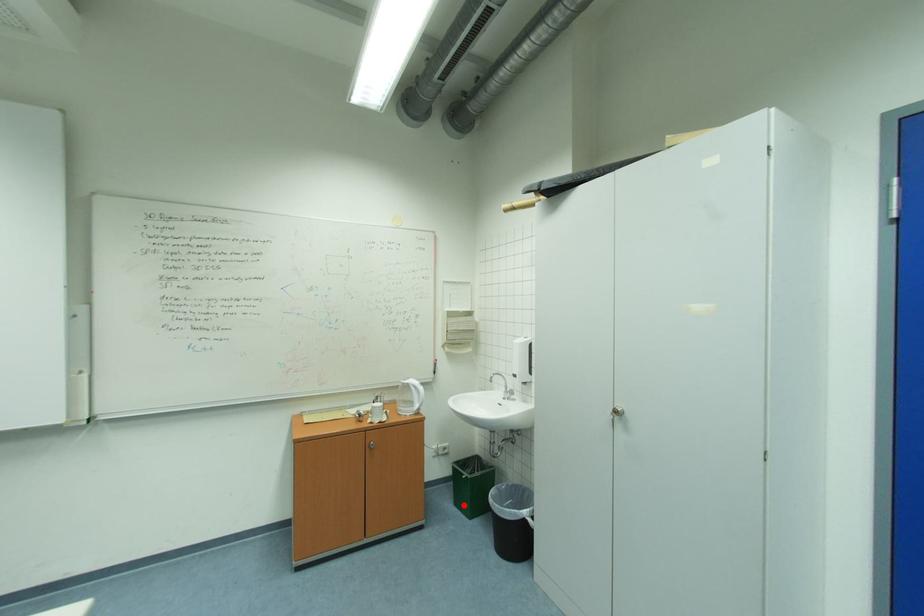
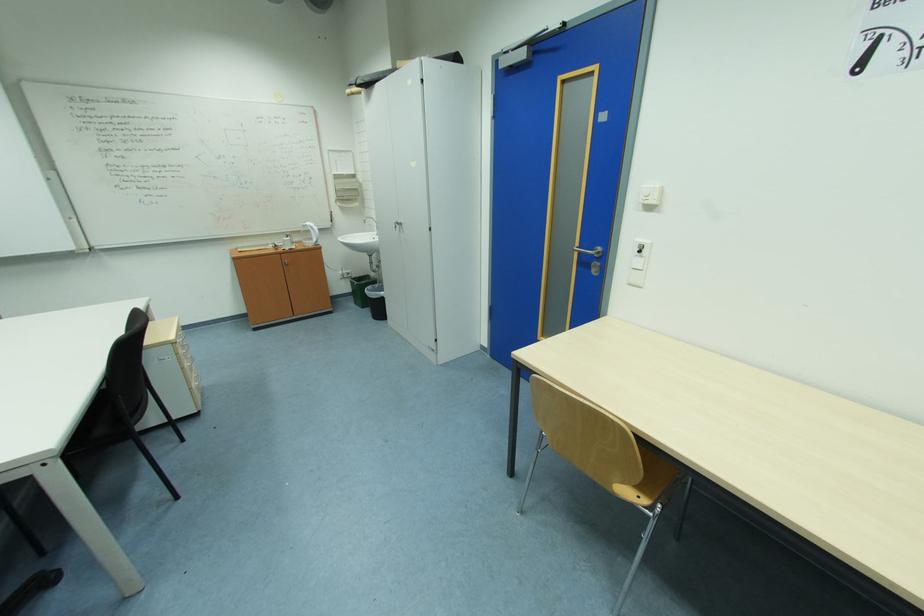
In the second image, find the point that corresponds to the highlighted location in the first image.

(362, 304)